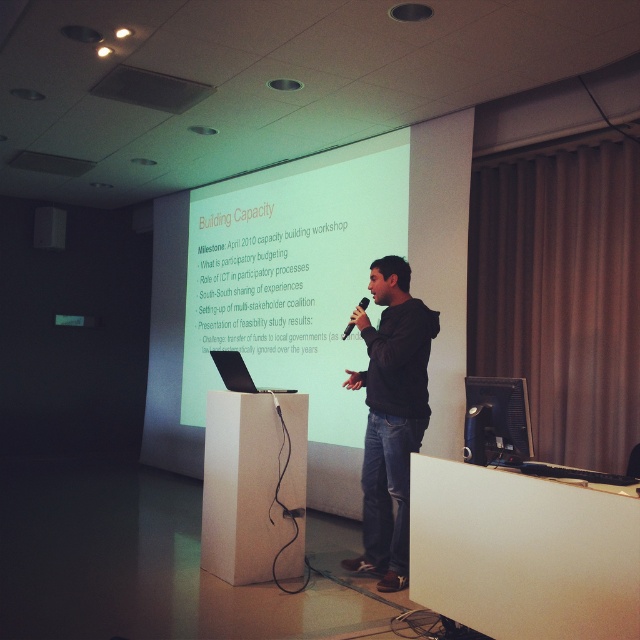
Question: Is black hoodie at center to the left of black matte speaker at center from the viewer's perspective?

Choices:
 (A) yes
 (B) no

Answer: (B)

Question: Which point appears closest to the camera in this image?

Choices:
 (A) (52, 237)
 (B) (333, 202)
 (C) (227, 515)
 (D) (365, 296)

Answer: (C)

Question: Which object is closer to the camera taking this photo?

Choices:
 (A) black matte speaker at center
 (B) white matte projection screen at center
 (C) black hoodie at center

Answer: (C)

Question: Which object appears closest to the camera in this image?

Choices:
 (A) white cardboard podium at center
 (B) black matte microphone at center
 (C) white matte projection screen at center
 (D) black matte speaker at center

Answer: (B)

Question: Where is white matte projection screen at center located in relation to black matte microphone at center in the image?

Choices:
 (A) left
 (B) right

Answer: (A)

Question: Does black matte speaker at center have a smaller size compared to black matte microphone at center?

Choices:
 (A) yes
 (B) no

Answer: (B)